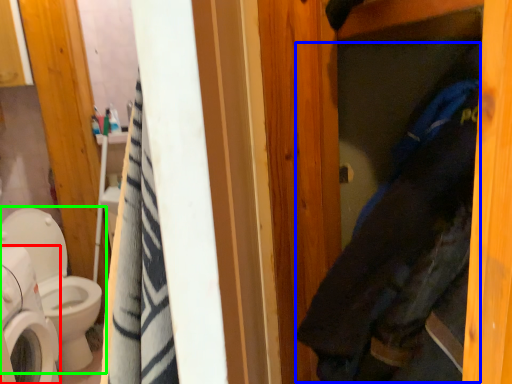
Question: Based on their relative distances, which object is nearer to washing machine (highlighted by a red box)? Choose from clothing (highlighted by a blue box) and toilet (highlighted by a green box).

Choices:
 (A) clothing
 (B) toilet

Answer: (B)